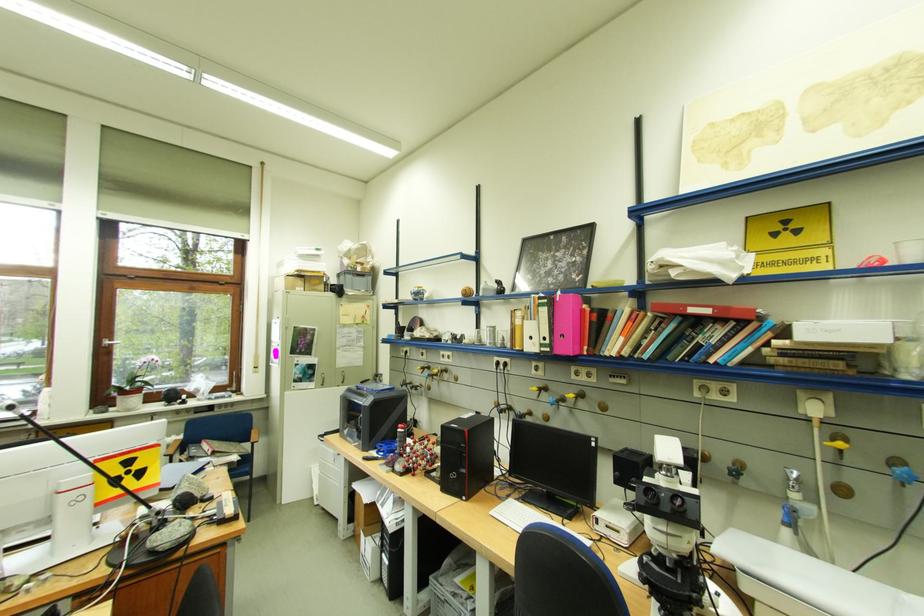
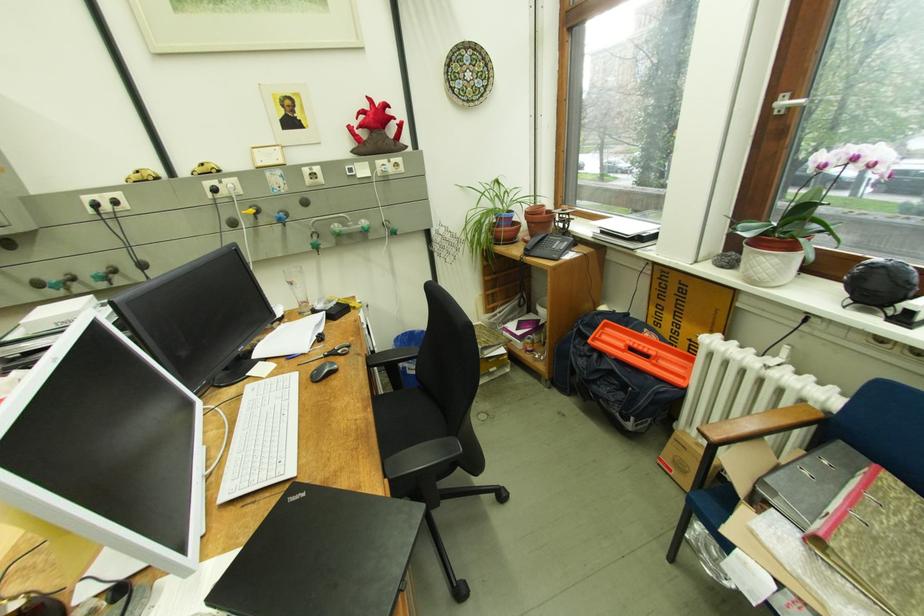
Where in the second image is the point corresponding to point 130,399 from the first image?

(758, 249)